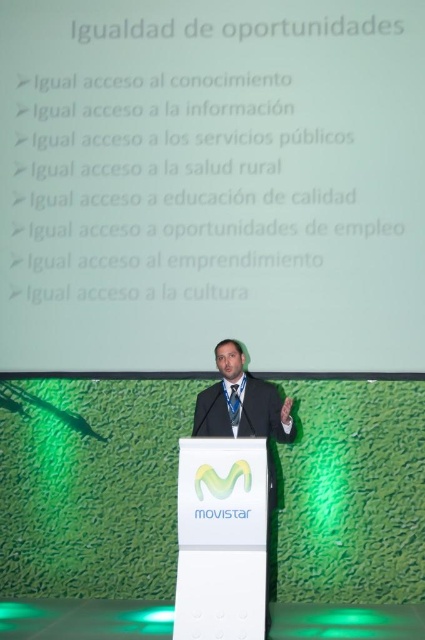
Question: Which object is positioned closest to the white plastic podium at center?

Choices:
 (A) white matte projector screen at upper center
 (B) blue satin tie at center

Answer: (B)

Question: Is white plastic podium at center wider than black fabric business suit at center?

Choices:
 (A) yes
 (B) no

Answer: (B)

Question: Which of the following is the closest to the observer?

Choices:
 (A) black fabric business suit at center
 (B) blue satin tie at center

Answer: (A)

Question: Is matte black suit at center to the left of blue satin tie at center from the viewer's perspective?

Choices:
 (A) yes
 (B) no

Answer: (B)

Question: Among these points, which one is nearest to the camera?

Choices:
 (A) (238, 412)
 (B) (268, 404)
 (C) (210, 573)

Answer: (C)

Question: Can you confirm if white plastic podium at center is positioned to the left of matte black suit at center?

Choices:
 (A) yes
 (B) no

Answer: (A)